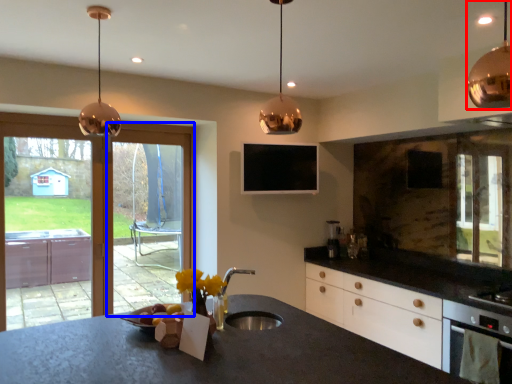
Question: Which point is further to the camera, lamp (highlighted by a red box) or screen door (highlighted by a blue box)?

Choices:
 (A) lamp
 (B) screen door

Answer: (B)